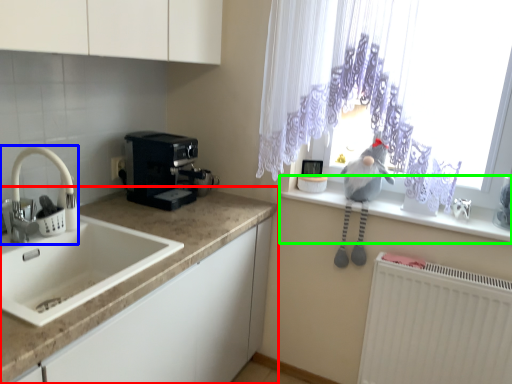
Question: Which object is positioned farthest from countertop (highlighted by a red box)? Select from tap (highlighted by a blue box) and window sill (highlighted by a green box).

Choices:
 (A) tap
 (B) window sill

Answer: (B)